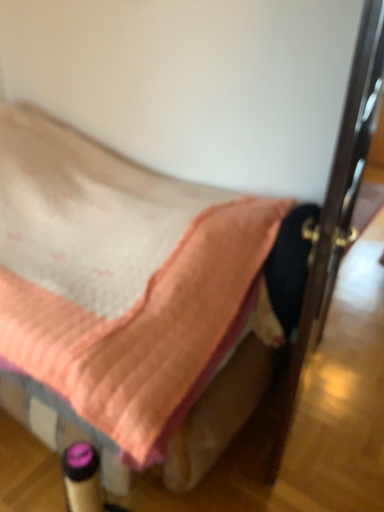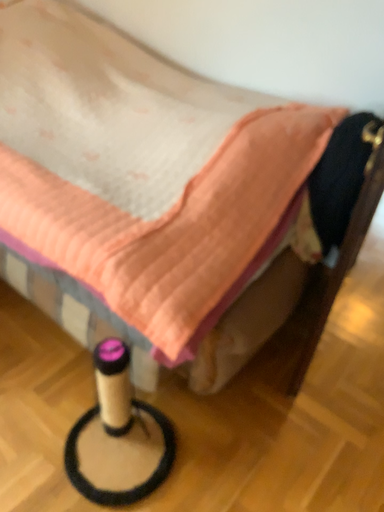
Question: How did the camera likely rotate when shooting the video?

Choices:
 (A) rotated downward
 (B) rotated upward

Answer: (A)